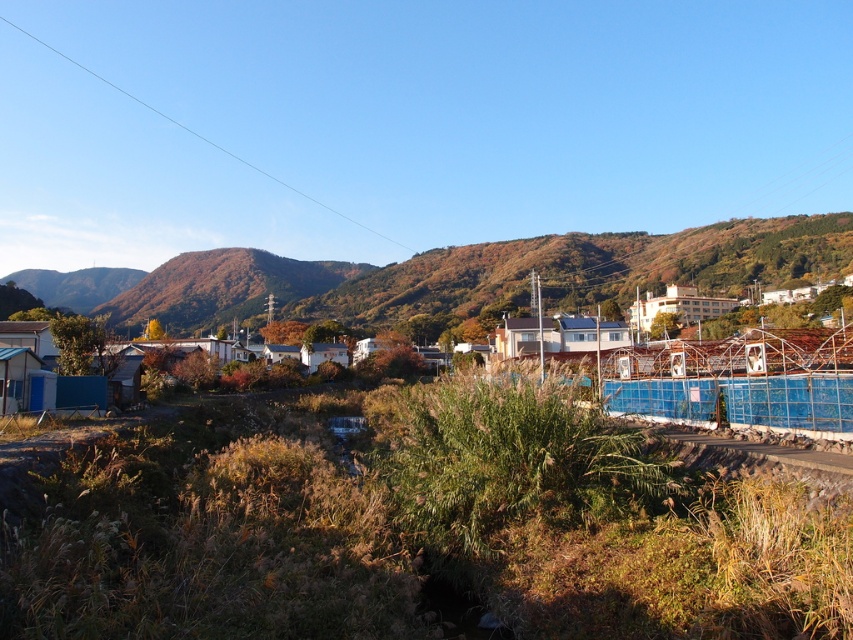
Question: Can you confirm if blue plastic amusement park at center is bigger than white matte building at lower left?

Choices:
 (A) no
 (B) yes

Answer: (A)

Question: Which object appears closest to the camera in this image?

Choices:
 (A) blue plastic amusement park at center
 (B) white matte building at lower left

Answer: (A)

Question: Is blue plastic amusement park at center to the right of white matte building at lower left from the viewer's perspective?

Choices:
 (A) yes
 (B) no

Answer: (A)

Question: Is blue plastic amusement park at center wider than white matte building at lower left?

Choices:
 (A) no
 (B) yes

Answer: (A)

Question: Among these points, which one is farthest from the camera?

Choices:
 (A) (842, 392)
 (B) (663, 593)

Answer: (A)